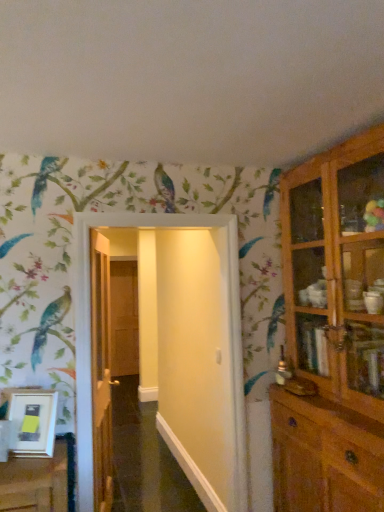
Question: Should I look upward or downward to see white glossy door at center, the 1th door viewed from the front?

Choices:
 (A) down
 (B) up

Answer: (A)

Question: Considering the relative sizes of wooden door at center, the second door in the right-to-left sequence, and brown wooden door at center, the third door when ordered from front to back, in the image provided, is wooden door at center, the second door in the right-to-left sequence, shorter than brown wooden door at center, the third door when ordered from front to back,?

Choices:
 (A) yes
 (B) no

Answer: (A)

Question: Does wooden door at center, the 2th door viewed from the back, have a greater height compared to brown wooden door at center, arranged as the third door when viewed from the right?

Choices:
 (A) yes
 (B) no

Answer: (B)

Question: Does wooden door at center, the 2th door viewed from the back, come behind brown wooden door at center, the third door when ordered from front to back?

Choices:
 (A) yes
 (B) no

Answer: (B)

Question: Can you confirm if wooden door at center, the second door in the right-to-left sequence, is smaller than brown wooden door at center, the third door when ordered from front to back?

Choices:
 (A) yes
 (B) no

Answer: (B)

Question: Considering the relative positions of wooden door at center, which ranks as the 2th door in left-to-right order, and brown wooden door at center, the 1th door in the left-to-right sequence, in the image provided, is wooden door at center, which ranks as the 2th door in left-to-right order, to the left of brown wooden door at center, the 1th door in the left-to-right sequence, from the viewer's perspective?

Choices:
 (A) no
 (B) yes

Answer: (A)

Question: From the image's perspective, is wooden door at center, the 2th door viewed from the back, over brown wooden door at center, the 1th door in the left-to-right sequence?

Choices:
 (A) no
 (B) yes

Answer: (B)

Question: Is brown wooden door at center, the first door in the back-to-front sequence, closer to the viewer compared to white glossy door at center, which appears as the 3th door when viewed from the back?

Choices:
 (A) yes
 (B) no

Answer: (B)

Question: Is brown wooden door at center, the first door in the back-to-front sequence, positioned with its back to white glossy door at center, the 3th door positioned from the left?

Choices:
 (A) no
 (B) yes

Answer: (A)

Question: Is brown wooden door at center, the first door in the back-to-front sequence, far away from white glossy door at center, the 1th door viewed from the front?

Choices:
 (A) no
 (B) yes

Answer: (B)

Question: From a real-world perspective, does brown wooden door at center, arranged as the third door when viewed from the right, sit lower than white glossy door at center, the 3th door positioned from the left?

Choices:
 (A) yes
 (B) no

Answer: (A)

Question: Is brown wooden door at center, the 1th door in the left-to-right sequence, wider than white glossy door at center, the 3th door positioned from the left?

Choices:
 (A) no
 (B) yes

Answer: (A)

Question: Does brown wooden door at center, arranged as the third door when viewed from the right, appear on the right side of white glossy door at center, the first door viewed from the right?

Choices:
 (A) yes
 (B) no

Answer: (B)

Question: Can you confirm if white glossy door at center, the 3th door positioned from the left, is bigger than brown wooden door at center, the 1th door in the left-to-right sequence?

Choices:
 (A) yes
 (B) no

Answer: (A)